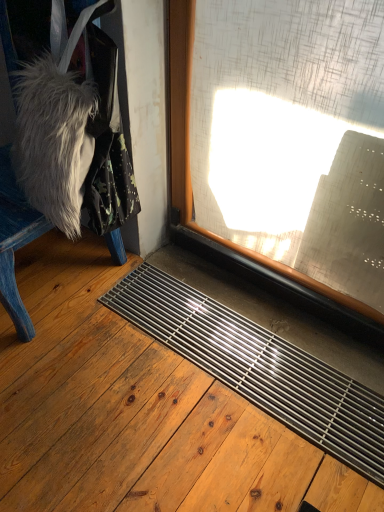
Question: Looking at their shapes, would you say transparent glass window at center is wider or thinner than metallic grid at lower center?

Choices:
 (A) thin
 (B) wide

Answer: (A)

Question: In the image, is transparent glass window at center on the left side or the right side of metallic grid at lower center?

Choices:
 (A) left
 (B) right

Answer: (B)

Question: Estimate the real-world distances between objects in this image. Which object is closer to the blue painted wood chair at left?

Choices:
 (A) metallic grid at lower center
 (B) transparent glass window at center

Answer: (B)

Question: Which of these objects is positioned farthest from the transparent glass window at center?

Choices:
 (A) blue painted wood chair at left
 (B) metallic grid at lower center

Answer: (A)